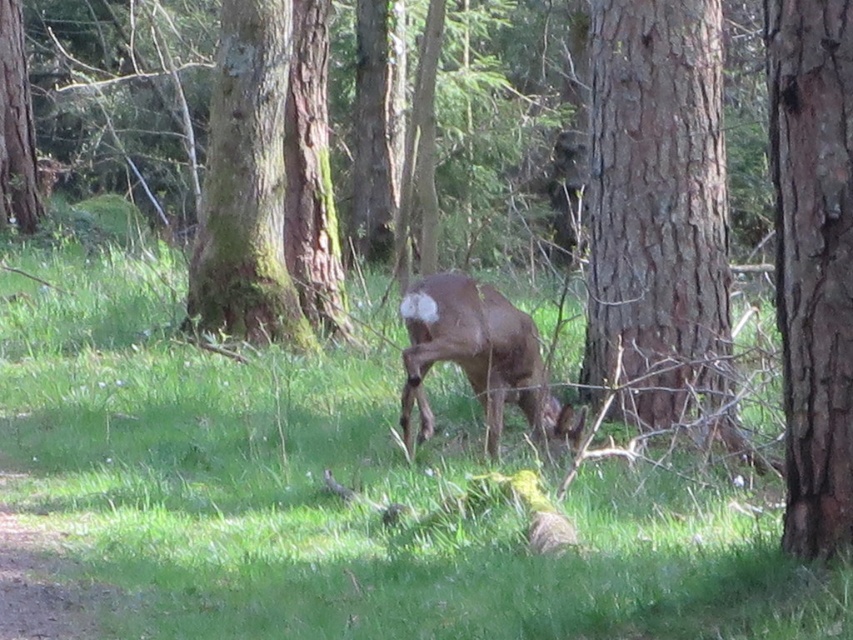
You are a hiker trying to navigate through the forest and spot two points marked on your map. The first point is at coordinate point(554, 422) and the second point is at coordinate point(3, 29). If you are standing at the deer grazing in the grassy area, which point is closer to you?

Point(554, 422) is in front of point(3, 29), so the first point is closer to you.